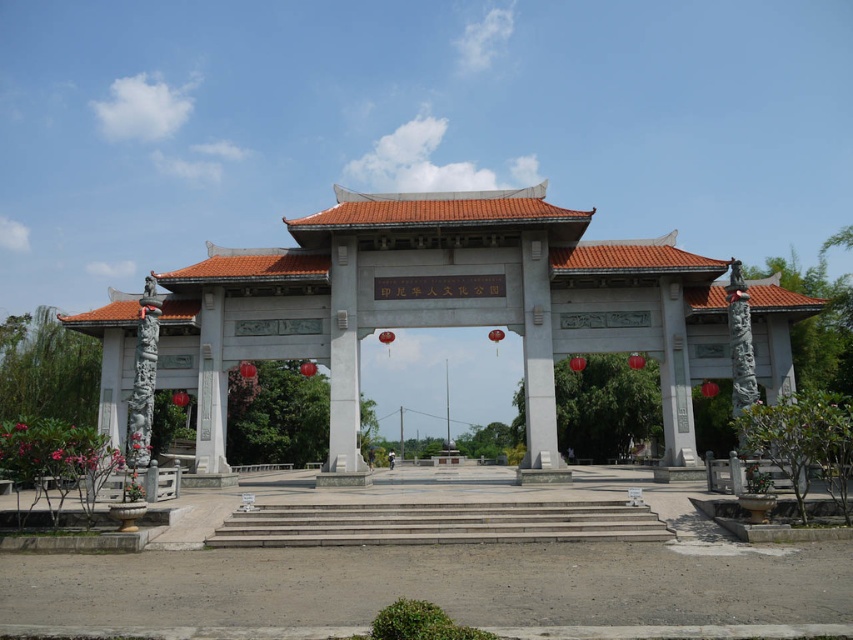
Question: Which object appears farthest from the camera in this image?

Choices:
 (A) concrete stairs at center
 (B) white stone gate at center

Answer: (B)

Question: Which point appears farthest from the camera in this image?

Choices:
 (A) (648, 529)
 (B) (337, 474)

Answer: (B)

Question: Is white stone gate at center further to the viewer compared to concrete stairs at center?

Choices:
 (A) no
 (B) yes

Answer: (B)

Question: Considering the relative positions of white stone gate at center and concrete stairs at center in the image provided, where is white stone gate at center located with respect to concrete stairs at center?

Choices:
 (A) above
 (B) below

Answer: (A)

Question: Which point appears closest to the camera in this image?

Choices:
 (A) (432, 276)
 (B) (274, 520)

Answer: (B)

Question: Is white stone gate at center thinner than concrete stairs at center?

Choices:
 (A) yes
 (B) no

Answer: (B)